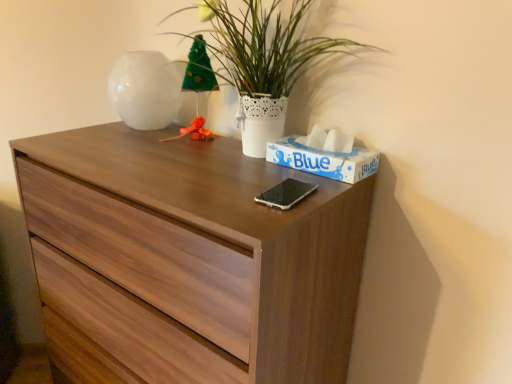
Question: Does white glossy vase at upper left have a smaller size compared to blue cardboard tissue box at upper right?

Choices:
 (A) yes
 (B) no

Answer: (B)

Question: Could you tell me if white glossy vase at upper left is turned towards blue cardboard tissue box at upper right?

Choices:
 (A) no
 (B) yes

Answer: (A)

Question: Is white glossy vase at upper left looking in the opposite direction of blue cardboard tissue box at upper right?

Choices:
 (A) yes
 (B) no

Answer: (B)

Question: From the image's perspective, is white glossy vase at upper left beneath blue cardboard tissue box at upper right?

Choices:
 (A) no
 (B) yes

Answer: (A)

Question: Considering the relative sizes of white glossy vase at upper left and blue cardboard tissue box at upper right in the image provided, is white glossy vase at upper left wider than blue cardboard tissue box at upper right?

Choices:
 (A) yes
 (B) no

Answer: (A)

Question: Is point (344, 173) closer or farther from the camera than point (143, 96)?

Choices:
 (A) closer
 (B) farther

Answer: (A)

Question: From a real-world perspective, is blue cardboard tissue box at upper right physically located above or below white glossy vase at upper left?

Choices:
 (A) below
 (B) above

Answer: (A)

Question: In the image, is blue cardboard tissue box at upper right positioned in front of or behind white glossy vase at upper left?

Choices:
 (A) front
 (B) behind

Answer: (A)

Question: From their relative heights in the image, would you say blue cardboard tissue box at upper right is taller or shorter than white glossy vase at upper left?

Choices:
 (A) tall
 (B) short

Answer: (B)

Question: Is white glossy vase at upper left in front of or behind wooden chest of drawers at center in the image?

Choices:
 (A) behind
 (B) front

Answer: (A)

Question: Considering the relative positions of white glossy vase at upper left and wooden chest of drawers at center in the image provided, is white glossy vase at upper left to the left or to the right of wooden chest of drawers at center?

Choices:
 (A) left
 (B) right

Answer: (A)

Question: From the image's perspective, is white glossy vase at upper left above or below wooden chest of drawers at center?

Choices:
 (A) below
 (B) above

Answer: (B)

Question: From a real-world perspective, is white glossy vase at upper left positioned above or below wooden chest of drawers at center?

Choices:
 (A) below
 (B) above

Answer: (B)

Question: In the image, is blue cardboard tissue box at upper right positioned in front of or behind wooden chest of drawers at center?

Choices:
 (A) front
 (B) behind

Answer: (B)

Question: From a real-world perspective, relative to wooden chest of drawers at center, is blue cardboard tissue box at upper right vertically above or below?

Choices:
 (A) above
 (B) below

Answer: (A)